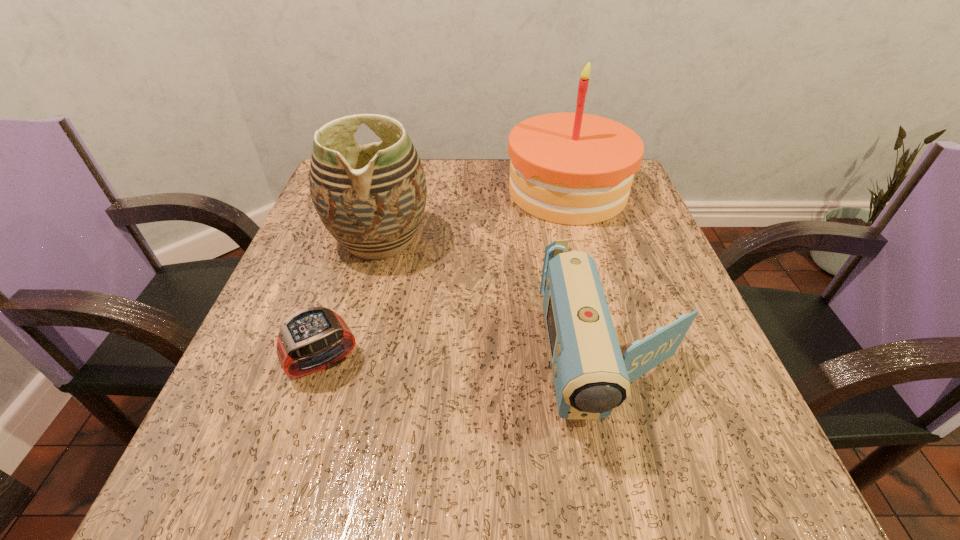
Identify the location of the tallest object. The image size is (960, 540). (568, 168).

Find the location of a particular element. the third shortest object is located at coordinates (x=371, y=198).

At what (x,y) coordinates should I click in order to perform the action: click on the second shortest object. Please return your answer as a coordinate pair (x, y). This screenshot has height=540, width=960. Looking at the image, I should click on (591, 377).

Identify the location of the shortest object. (311, 332).

The image size is (960, 540). What are the coordinates of `free region located on the front of the birthday cake` in the screenshot? It's located at (587, 261).

Where is `free space located 0.110m on the back of the pottery`? The width and height of the screenshot is (960, 540). free space located 0.110m on the back of the pottery is located at coordinates (395, 184).

The width and height of the screenshot is (960, 540). Identify the location of vacant space located 0.170m on the front of the watch. (277, 507).

Where is `birthday cake present at the far edge`? This screenshot has width=960, height=540. birthday cake present at the far edge is located at coordinates (568, 168).

Find the location of a particular element. pottery that is at the far edge is located at coordinates (371, 198).

Where is `object that is at the near edge`? object that is at the near edge is located at coordinates (591, 377).